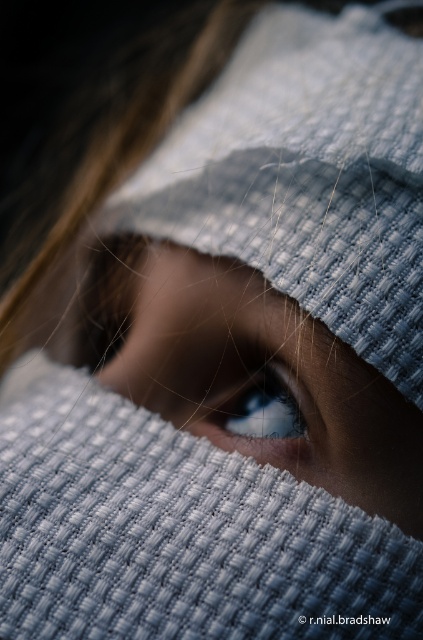
You are an artist trying to paint the scene described. You notice two objects labeled as blue glossy eye at center and glossy blue eye at center. Which one is larger in size?

The blue glossy eye at center is bigger than the glossy blue eye at center according to the description.

You are an artist trying to paint the scene. You notice two objects labeled blue glossy eye at center and glossy blue eye at center. Which one is actually the real eye of the person?

The blue glossy eye at center is the real eye of the person because it is positioned over the glossy blue eye at center, indicating it is the foreground object.